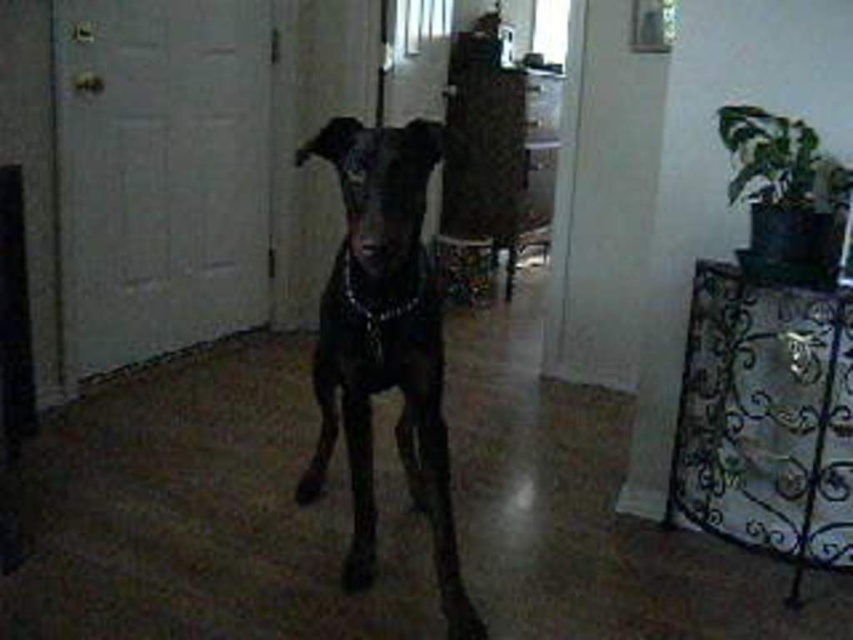
Between shiny black dog at center and black chain at center, which one has more height?

shiny black dog at center

Between shiny black dog at center and black chain at center, which one is positioned higher?

Positioned higher is black chain at center.

Measure the distance between shiny black dog at center and camera.

They are 5.92 feet apart.

I want to click on shiny black dog at center, so click(x=384, y=344).